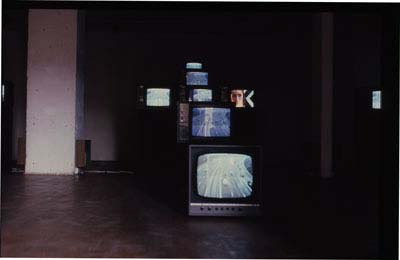
Locate an element on the screen. The height and width of the screenshot is (260, 400). knobs is located at coordinates (202, 209).